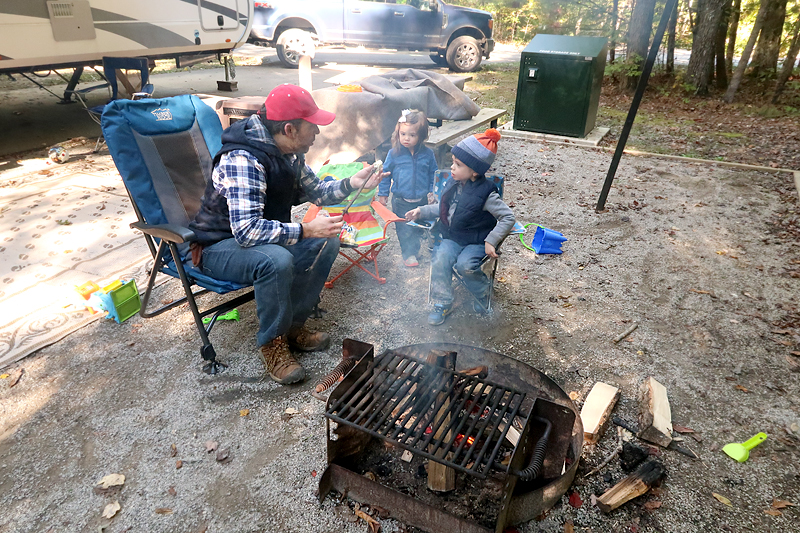
The height and width of the screenshot is (533, 800). In order to click on blanket in this screenshot , I will do `click(69, 208)`.